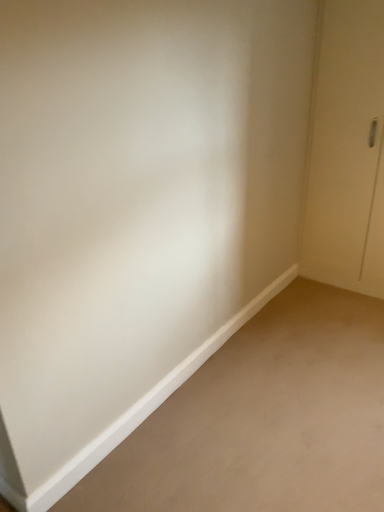
This screenshot has width=384, height=512. What are the coordinates of `vacant area to the left of white matte door at right` in the screenshot? It's located at tap(310, 293).